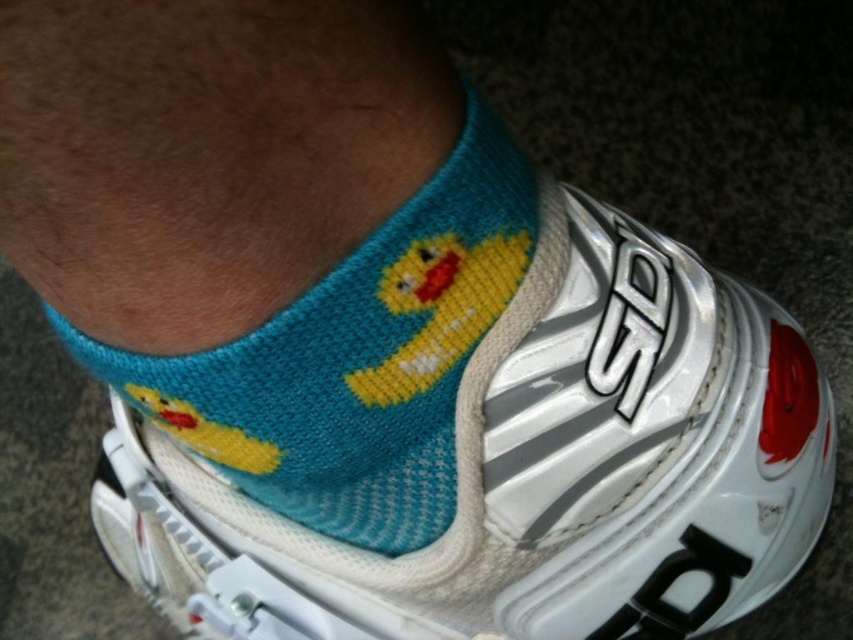
Can you confirm if white mesh shoe at center is positioned to the left of teal knitted socks at center?

No, white mesh shoe at center is not to the left of teal knitted socks at center.

Can you confirm if white mesh shoe at center is wider than teal knitted socks at center?

Yes.

Is point (724, 531) closer to camera compared to point (498, 289)?

No, (724, 531) is further to viewer.

Find the location of a particular element. The height and width of the screenshot is (640, 853). white mesh shoe at center is located at coordinates (532, 472).